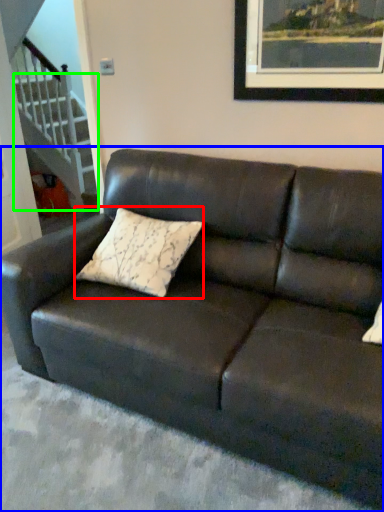
Question: Which is nearer to the pillow (highlighted by a red box)? studio couch (highlighted by a blue box) or stairwell (highlighted by a green box).

Choices:
 (A) studio couch
 (B) stairwell

Answer: (A)